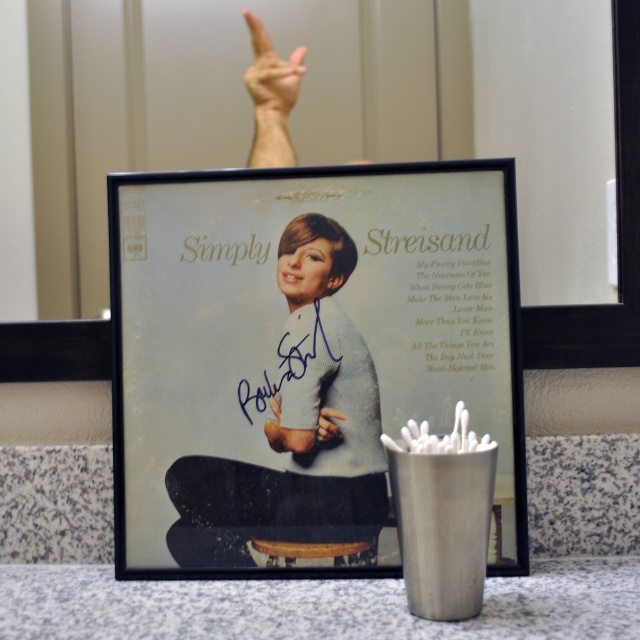
Is matte black picture frame at center below matte gray sweater at center?

No.

Which is in front, point (182, 429) or point (323, 497)?

Positioned in front is point (323, 497).

This screenshot has width=640, height=640. Identify the location of matte black picture frame at center. (307, 358).

In the scene shown: Is matte gray sweater at center above skinny white hand at upper center?

No.

Is point (298, 547) positioned in front of point (259, 99)?

Yes, it is in front of point (259, 99).

Between point (316, 272) and point (278, 108), which one is positioned behind?

Positioned behind is point (278, 108).

Identify the location of matte gray sweater at center. This screenshot has width=640, height=640. (298, 433).

Can you confirm if matte gray sweater at center is positioned above matte black hand at upper center?

→ No, matte gray sweater at center is not above matte black hand at upper center.

Based on the photo, who is lower down, matte gray sweater at center or matte black hand at upper center?

matte gray sweater at center

Who is more forward, (x=266, y=538) or (x=333, y=410)?

Point (x=266, y=538) is in front.

The height and width of the screenshot is (640, 640). What are the coordinates of `matte gray sweater at center` in the screenshot? It's located at (298, 433).